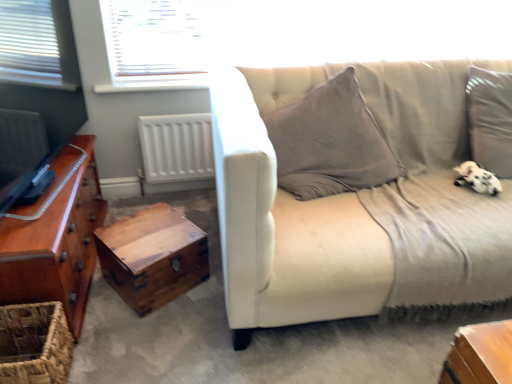
You are a GUI agent. You are given a task and a screenshot of the screen. Output one action in this format:
    pyautogui.click(x=<x>, y=<y>)
    Task: Click on the vacant area in front of wooden chest at lower left
    The image size is (512, 384).
    Given the screenshot: What is the action you would take?
    pyautogui.click(x=145, y=328)